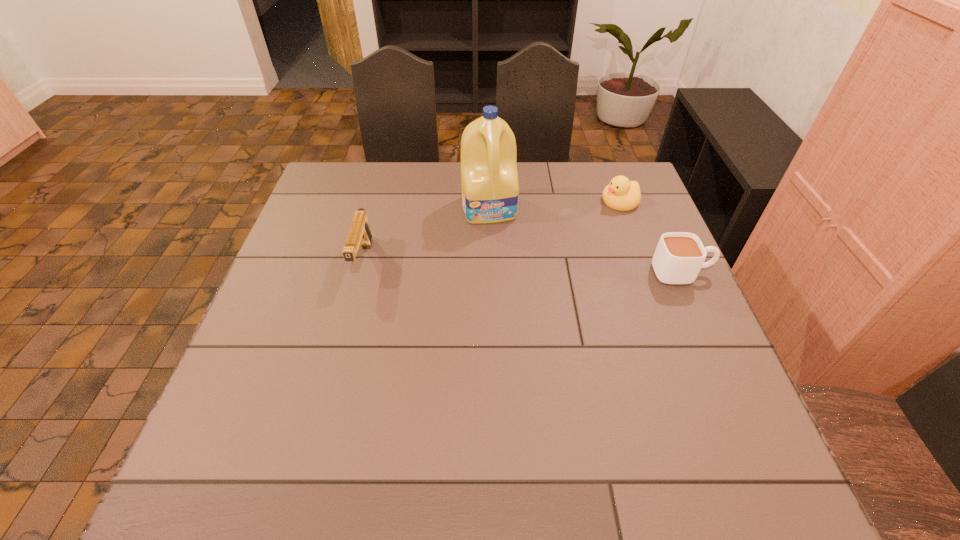
Identify the location of vacant position located on the label of the tallest object. The width and height of the screenshot is (960, 540). (498, 239).

Identify the location of vacant area situated 0.300m on the label of the tallest object. This screenshot has height=540, width=960. (516, 306).

This screenshot has height=540, width=960. Identify the location of free spot located 0.330m on the label of the tallest object. (519, 316).

Where is `duckling that is positioned at the far edge`? Image resolution: width=960 pixels, height=540 pixels. duckling that is positioned at the far edge is located at coordinates (621, 194).

I want to click on detergent present at the far edge, so click(489, 178).

Where is `cup at the right edge`? The image size is (960, 540). cup at the right edge is located at coordinates (679, 256).

I want to click on duckling at the right edge, so click(x=621, y=194).

Locate an element on the screen. object that is at the far right corner is located at coordinates (621, 194).

Where is `vacant space at the far edge of the desktop`? The image size is (960, 540). vacant space at the far edge of the desktop is located at coordinates (519, 204).

The height and width of the screenshot is (540, 960). Find the location of `blank space at the near edge of the desktop`. blank space at the near edge of the desktop is located at coordinates (594, 429).